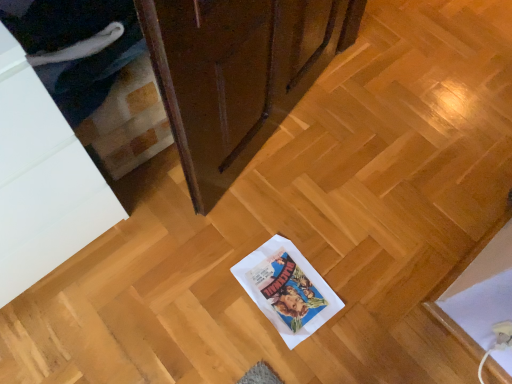
Question: Which direction should I rotate to face matte brown cabinet at upper center, the 2th cabinetry from the left, — up or down?

Choices:
 (A) up
 (B) down

Answer: (A)

Question: Is matte brown cabinet at upper center, the 2th cabinetry from the left, surrounded by white glossy cabinet at left, which ranks as the second cabinetry in right-to-left order?

Choices:
 (A) no
 (B) yes

Answer: (A)

Question: From a real-world perspective, is white glossy cabinet at left, the 1th cabinetry viewed from the left, located beneath matte brown cabinet at upper center, positioned as the 1th cabinetry in right-to-left order?

Choices:
 (A) no
 (B) yes

Answer: (A)

Question: Is white glossy cabinet at left, the 1th cabinetry viewed from the left, outside matte brown cabinet at upper center, the 2th cabinetry from the left?

Choices:
 (A) no
 (B) yes

Answer: (B)

Question: Can you confirm if white glossy cabinet at left, which ranks as the second cabinetry in right-to-left order, is wider than matte brown cabinet at upper center, positioned as the 1th cabinetry in right-to-left order?

Choices:
 (A) no
 (B) yes

Answer: (B)

Question: Is white glossy cabinet at left, the 1th cabinetry viewed from the left, positioned behind matte brown cabinet at upper center, positioned as the 1th cabinetry in right-to-left order?

Choices:
 (A) no
 (B) yes

Answer: (A)

Question: Is white glossy cabinet at left, the 1th cabinetry viewed from the left, thinner than matte brown cabinet at upper center, the 2th cabinetry from the left?

Choices:
 (A) no
 (B) yes

Answer: (A)

Question: Is matte brown cabinet at upper center, the 2th cabinetry from the left, next to white glossy cabinet at left, which ranks as the second cabinetry in right-to-left order?

Choices:
 (A) yes
 (B) no

Answer: (B)

Question: From a real-world perspective, is matte brown cabinet at upper center, the 2th cabinetry from the left, physically below white glossy cabinet at left, the 1th cabinetry viewed from the left?

Choices:
 (A) yes
 (B) no

Answer: (A)

Question: Considering the relative sizes of matte brown cabinet at upper center, the 2th cabinetry from the left, and white glossy cabinet at left, the 1th cabinetry viewed from the left, in the image provided, is matte brown cabinet at upper center, the 2th cabinetry from the left, wider than white glossy cabinet at left, the 1th cabinetry viewed from the left,?

Choices:
 (A) yes
 (B) no

Answer: (B)

Question: Considering the relative sizes of matte brown cabinet at upper center, positioned as the 1th cabinetry in right-to-left order, and white glossy cabinet at left, which ranks as the second cabinetry in right-to-left order, in the image provided, is matte brown cabinet at upper center, positioned as the 1th cabinetry in right-to-left order, taller than white glossy cabinet at left, which ranks as the second cabinetry in right-to-left order,?

Choices:
 (A) no
 (B) yes

Answer: (A)

Question: Can you confirm if matte brown cabinet at upper center, the 2th cabinetry from the left, is bigger than white glossy cabinet at left, the 1th cabinetry viewed from the left?

Choices:
 (A) yes
 (B) no

Answer: (B)

Question: Is matte brown cabinet at upper center, the 2th cabinetry from the left, behind white glossy cabinet at left, which ranks as the second cabinetry in right-to-left order?

Choices:
 (A) no
 (B) yes

Answer: (B)

Question: Considering their positions, is white glossy cabinet at left, the 1th cabinetry viewed from the left, located in front of or behind matte brown cabinet at upper center, positioned as the 1th cabinetry in right-to-left order?

Choices:
 (A) front
 (B) behind

Answer: (A)